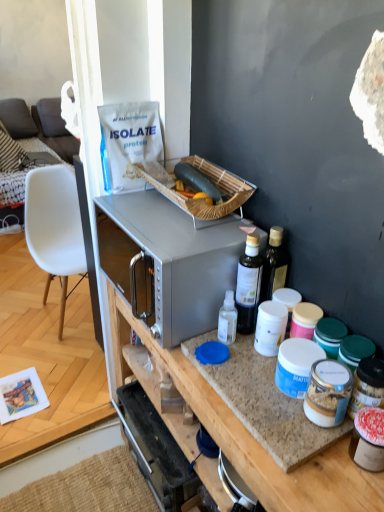
Find the location of a particular element. The height and width of the screenshot is (512, 384). free space above satin silver microwave at center (from a real-world perspective) is located at coordinates (163, 219).